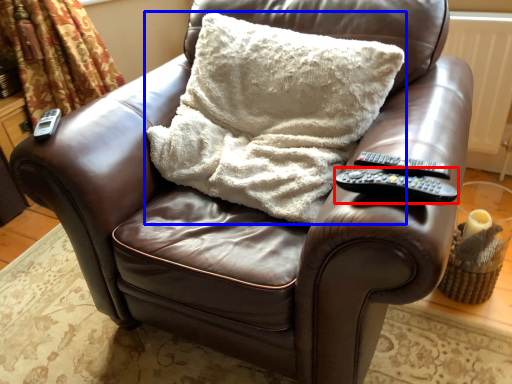
Question: Which point is further to the camera, remote (highlighted by a red box) or pillow (highlighted by a blue box)?

Choices:
 (A) remote
 (B) pillow

Answer: (B)